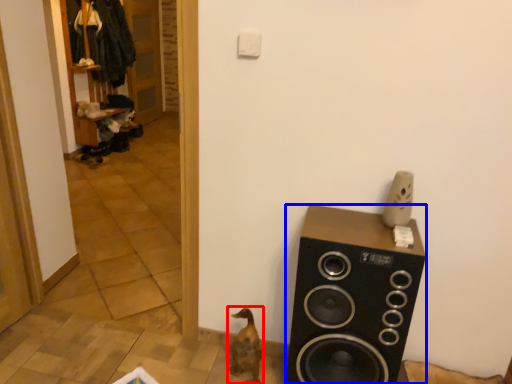
Question: Among these objects, which one is nearest to the camera, animal (highlighted by a red box) or speaker (highlighted by a blue box)?

Choices:
 (A) animal
 (B) speaker

Answer: (B)